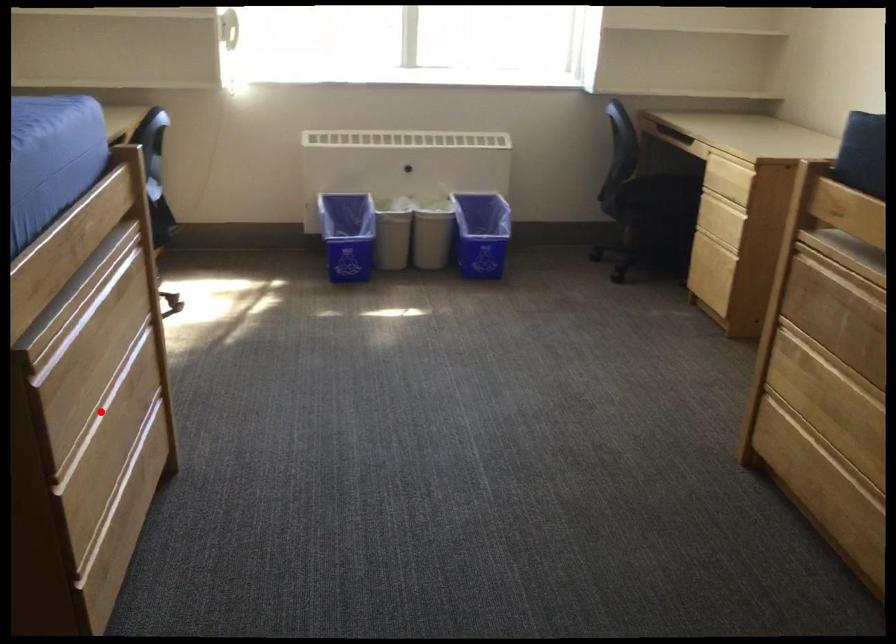
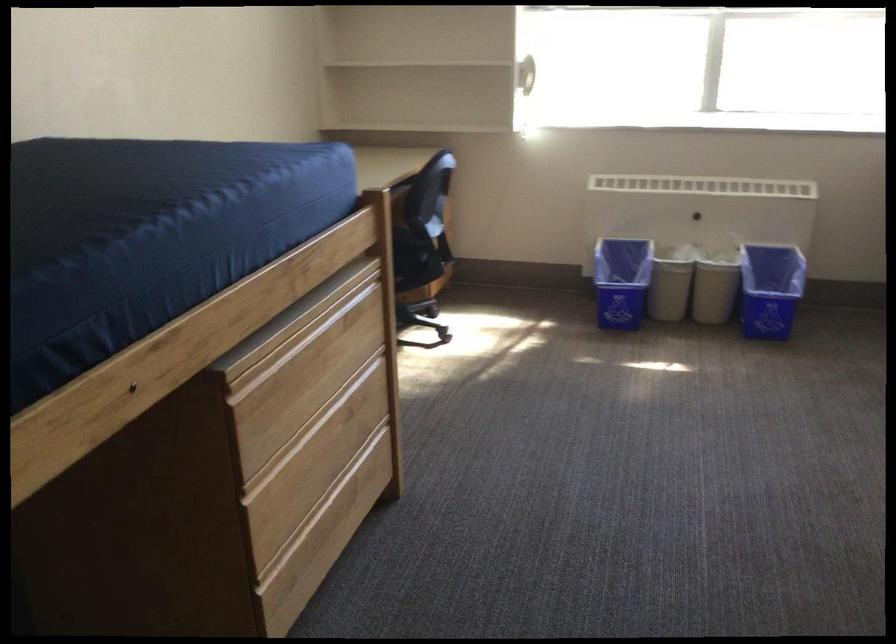
Find the pixel in the second image that matches the highlighted location in the first image.

(307, 431)